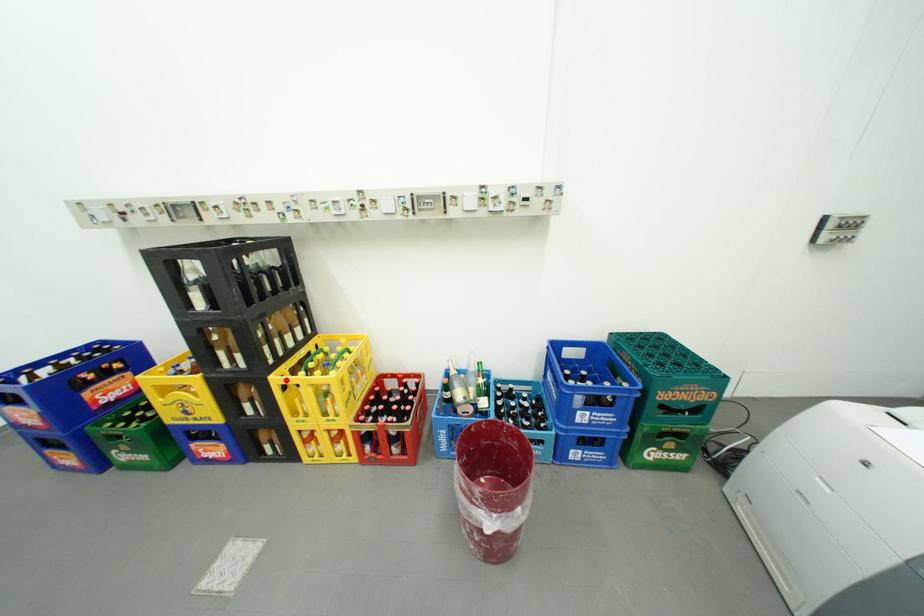
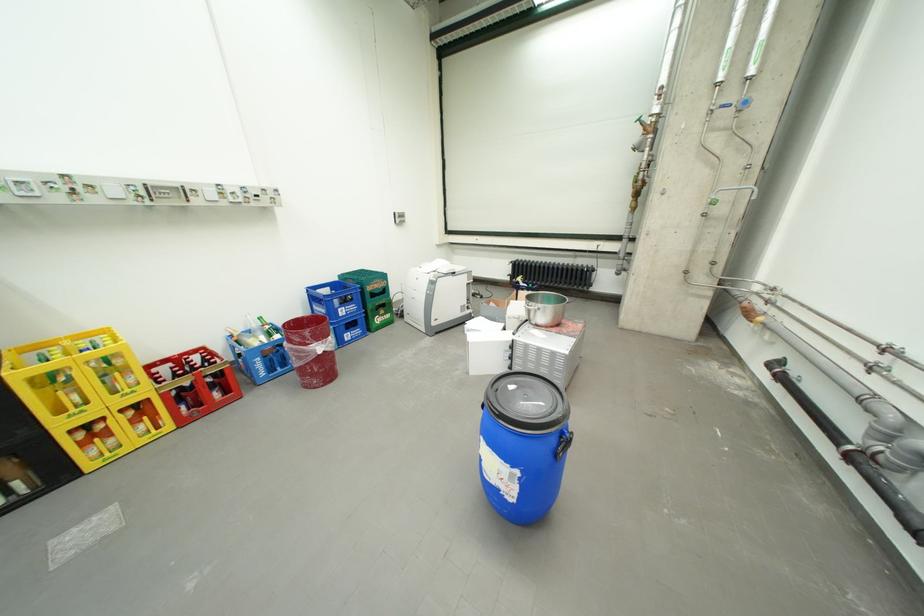
The point at the highlighted location is marked in the first image. Where is the corresponding point in the second image?

(30, 374)